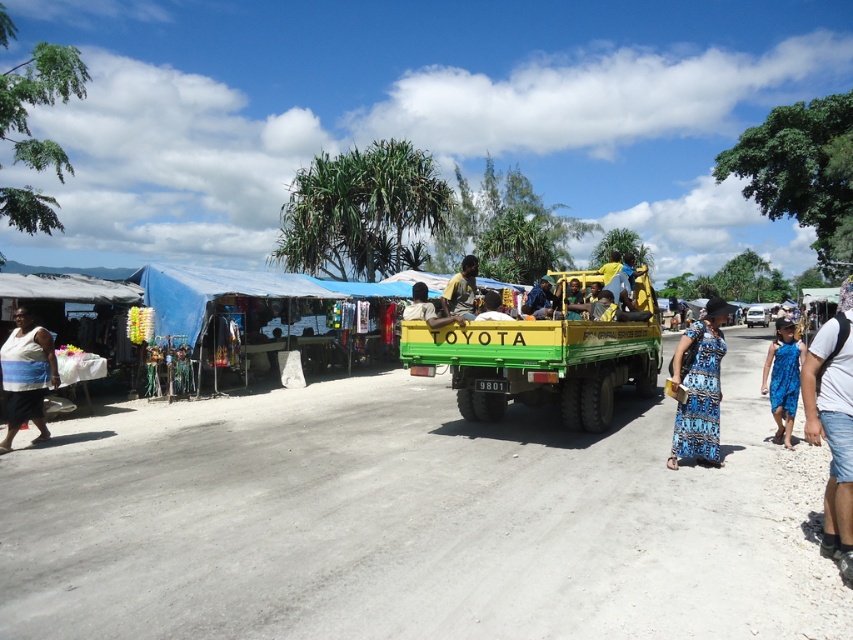
In the scene shown: You are standing at the center of the dirt road in front of the yellow Toyota truck. There are two points marked in the image. Which point, point (804, 390) or point (686, 417), is closer to you?

Point (804, 390) is closer to the viewer than point (686, 417).

You are a customer at the market and want to buy a garment. You notice the white cotton shirt at lower right and the blue printed dress at center. Which garment is shorter in length?

The white cotton shirt at lower right is shorter than the blue printed dress at center.

You are a customer at the market. You want to buy a souvenir and need to know which item is taller between the blue fabric canopy at left and the yellow fabric bag at center. Which one should you look at?

The blue fabric canopy at left is much taller than the yellow fabric bag at center, so you should look at the blue fabric canopy at left.